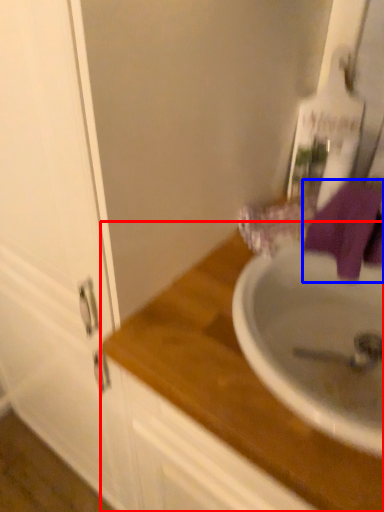
Question: Which of the following is the farthest to the observer, countertop (highlighted by a red box) or bath towel (highlighted by a blue box)?

Choices:
 (A) countertop
 (B) bath towel

Answer: (B)